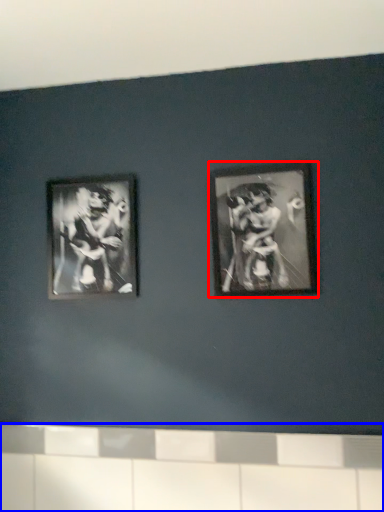
Question: Which object appears farthest to the camera in this image, picture frame (highlighted by a red box) or ledge (highlighted by a blue box)?

Choices:
 (A) picture frame
 (B) ledge

Answer: (A)